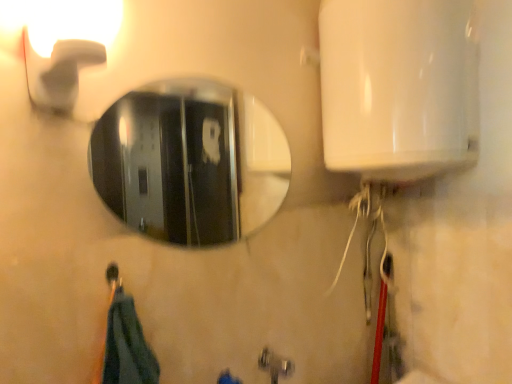
Question: Based on their sizes in the image, would you say matte white faucet at upper left is bigger or smaller than metallic silver faucet at lower center?

Choices:
 (A) big
 (B) small

Answer: (A)

Question: Considering the positions of matte white faucet at upper left and metallic silver faucet at lower center in the image, is matte white faucet at upper left taller or shorter than metallic silver faucet at lower center?

Choices:
 (A) short
 (B) tall

Answer: (B)

Question: Which of these objects is positioned closest to the shiny metallic mirror at center?

Choices:
 (A) metallic silver faucet at lower center
 (B) white glossy water heater at upper right
 (C) matte white faucet at upper left

Answer: (B)

Question: Which object is positioned closest to the shiny metallic mirror at center?

Choices:
 (A) metallic silver faucet at lower center
 (B) white glossy water heater at upper right
 (C) matte white faucet at upper left

Answer: (B)